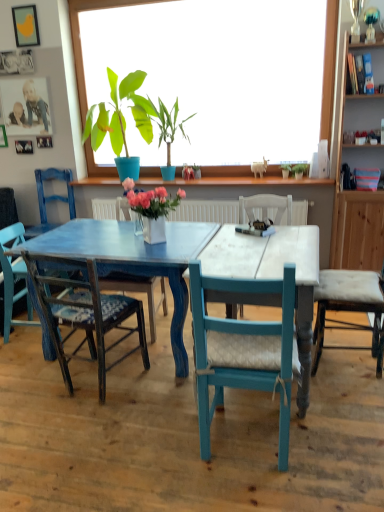
Question: Can you confirm if white ceramic vase at center, the 1th houseplant viewed from the front, is positioned to the left of matte blue chair at center, positioned as the 3th chair in right-to-left order?

Choices:
 (A) yes
 (B) no

Answer: (B)

Question: From a real-world perspective, is white ceramic vase at center, the 3th houseplant when ordered from right to left, positioned over matte blue chair at center, positioned as the 3th chair in right-to-left order, based on gravity?

Choices:
 (A) no
 (B) yes

Answer: (B)

Question: Is white ceramic vase at center, positioned as the third houseplant in left-to-right order, positioned behind matte blue chair at center, arranged as the fourth chair when viewed from the left?

Choices:
 (A) no
 (B) yes

Answer: (A)

Question: Is white ceramic vase at center, the 1th houseplant viewed from the front, facing towards matte blue chair at center, positioned as the 3th chair in right-to-left order?

Choices:
 (A) yes
 (B) no

Answer: (B)

Question: Is white ceramic vase at center, positioned as the third houseplant in left-to-right order, not within matte blue chair at center, arranged as the fourth chair when viewed from the left?

Choices:
 (A) no
 (B) yes

Answer: (B)

Question: Is brushed metal picture frame at upper left, which is counted as the 4th picture frame, starting from the top, wider or thinner than green matte plant at upper center, placed as the first houseplant when sorted from right to left?

Choices:
 (A) thin
 (B) wide

Answer: (A)

Question: From a real-world perspective, relative to green matte plant at upper center, which ranks as the 2th houseplant in back-to-front order, is brushed metal picture frame at upper left, which is counted as the 4th picture frame, starting from the top, vertically above or below?

Choices:
 (A) above
 (B) below

Answer: (A)

Question: Is point (38, 143) closer or farther from the camera than point (301, 173)?

Choices:
 (A) closer
 (B) farther

Answer: (B)

Question: Is brushed metal picture frame at upper left, which is counted as the 4th picture frame, starting from the top, inside or outside of green matte plant at upper center, the fourth houseplant positioned from the front?

Choices:
 (A) inside
 (B) outside

Answer: (B)

Question: In the image, is matte blue chair at center, positioned as the 3th chair in right-to-left order, positioned in front of or behind matte wooden picture frame at upper left, the fourth picture frame from the bottom?

Choices:
 (A) front
 (B) behind

Answer: (A)

Question: Is matte blue chair at center, positioned as the 3th chair in right-to-left order, taller or shorter than matte wooden picture frame at upper left, arranged as the second picture frame when viewed from the top?

Choices:
 (A) short
 (B) tall

Answer: (B)

Question: Is point (160, 278) positioned closer to the camera than point (46, 115)?

Choices:
 (A) farther
 (B) closer

Answer: (B)

Question: Considering the positions of matte blue chair at center, positioned as the 3th chair in right-to-left order, and matte wooden picture frame at upper left, the fourth picture frame from the bottom, in the image, is matte blue chair at center, positioned as the 3th chair in right-to-left order, bigger or smaller than matte wooden picture frame at upper left, the fourth picture frame from the bottom,?

Choices:
 (A) big
 (B) small

Answer: (A)

Question: Would you say green leafy plant at upper center, which is the second houseplant in right-to-left order, is to the left or to the right of green matte plant at upper center, placed as the first houseplant when sorted from right to left, in the picture?

Choices:
 (A) right
 (B) left

Answer: (B)

Question: Is green leafy plant at upper center, the 4th houseplant when ordered from left to right, situated inside green matte plant at upper center, acting as the 5th houseplant starting from the left, or outside?

Choices:
 (A) outside
 (B) inside

Answer: (A)